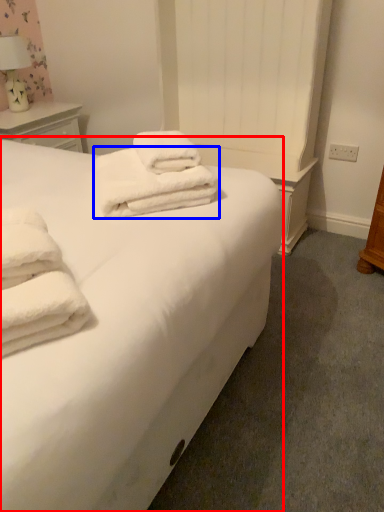
Question: Which object is closer to the camera taking this photo, bed (highlighted by a red box) or towel (highlighted by a blue box)?

Choices:
 (A) bed
 (B) towel

Answer: (A)